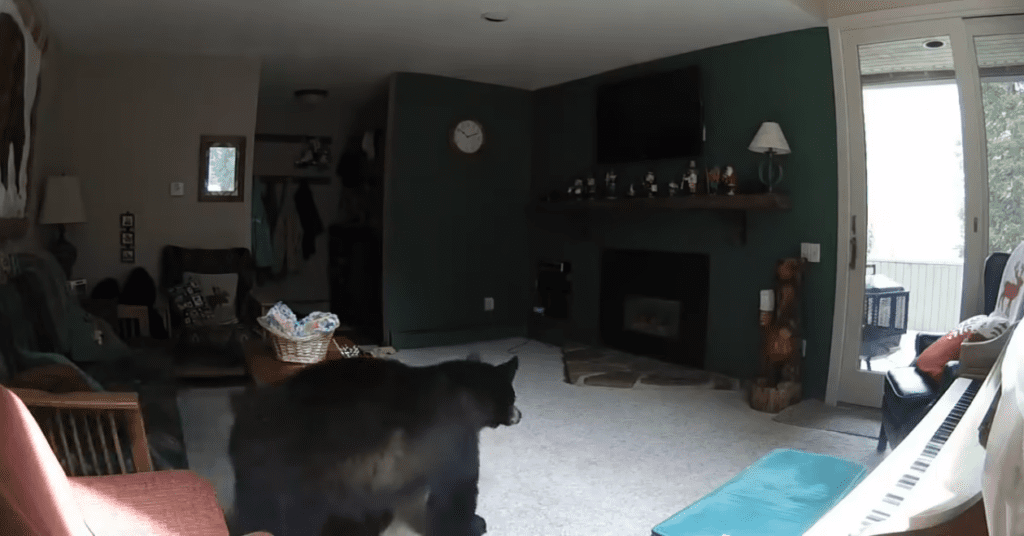
Where is `light gray carpet`? light gray carpet is located at coordinates (636, 478).